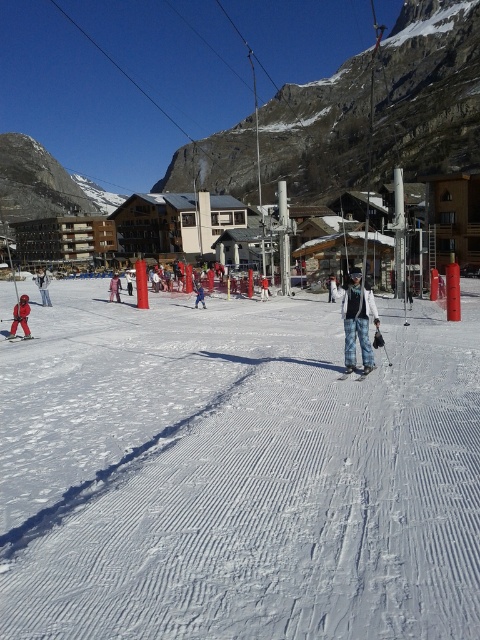
Question: Does pink fabric pants at center lie behind matte red ski at lower left?

Choices:
 (A) no
 (B) yes

Answer: (B)

Question: Is white snow pants at center to the right of matte red ski at lower left from the viewer's perspective?

Choices:
 (A) yes
 (B) no

Answer: (A)

Question: Which of the following is the farthest from the observer?

Choices:
 (A) pink fabric pants at center
 (B) rocky gray mountain at upper center
 (C) white snow pants at center
 (D) red ski suit at center

Answer: (B)

Question: Which point is closer to the camera taking this photo?

Choices:
 (A) (264, 282)
 (B) (205, 609)
 (C) (203, 296)
 (D) (348, 374)

Answer: (B)

Question: Does white snow pants at center have a greater width compared to matte red ski at lower left?

Choices:
 (A) yes
 (B) no

Answer: (A)

Question: Among these objects, which one is nearest to the camera?

Choices:
 (A) matte red ski at lower left
 (B) red ski suit at center
 (C) white snow pants at center
 (D) pink fabric pants at center

Answer: (A)